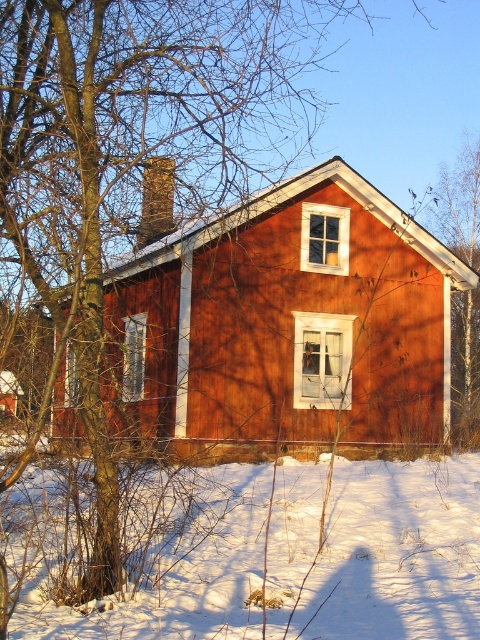
Can you confirm if white powdery snow at lower center is shorter than bare branches at upper right?

Correct, white powdery snow at lower center is not as tall as bare branches at upper right.

The height and width of the screenshot is (640, 480). I want to click on white powdery snow at lower center, so click(396, 554).

The image size is (480, 640). Describe the element at coordinates (396, 554) in the screenshot. I see `white powdery snow at lower center` at that location.

Where is `white powdery snow at lower center`? white powdery snow at lower center is located at coordinates (396, 554).